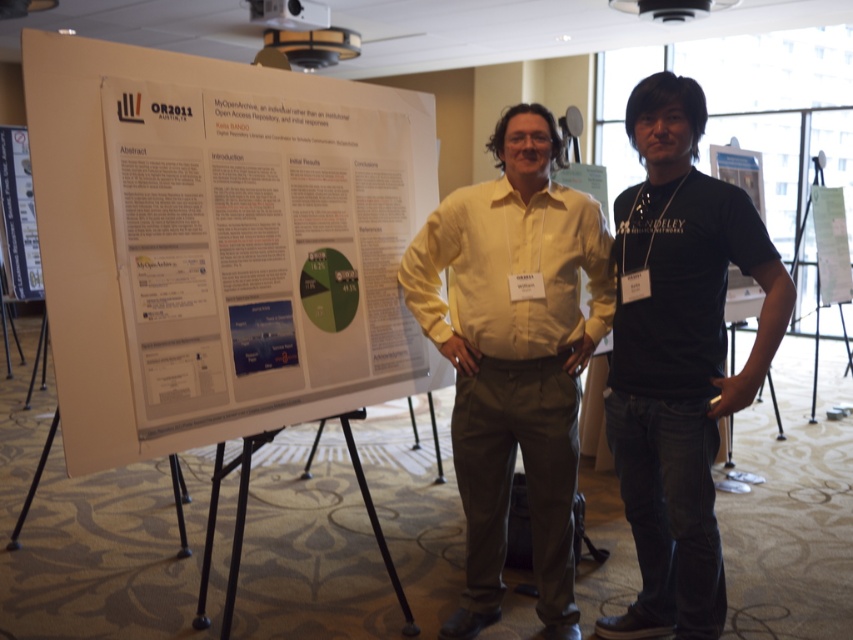
Is metallic silver poster at left shorter than white paper at center?

In fact, metallic silver poster at left may be taller than white paper at center.

This screenshot has width=853, height=640. Describe the element at coordinates (19, 214) in the screenshot. I see `metallic silver poster at left` at that location.

I want to click on metallic silver poster at left, so click(x=19, y=214).

Is yellow matte shirt at center smaller than metallic silver poster at left?

No.

Which of these two, yellow matte shirt at center or metallic silver poster at left, stands taller?

yellow matte shirt at center

Who is more distant from viewer, [486,358] or [33,220]?

Point [33,220]

The height and width of the screenshot is (640, 853). Find the location of `yellow matte shirt at center`. yellow matte shirt at center is located at coordinates (514, 355).

Does white paperboard at center have a greater width compared to white paper at center?

Yes.

Is white paperboard at center positioned at the back of white paper at center?

No, it is not.

Locate an element on the screen. white paperboard at center is located at coordinates (202, 252).

Locate an element on the screen. The width and height of the screenshot is (853, 640). white paperboard at center is located at coordinates (202, 252).